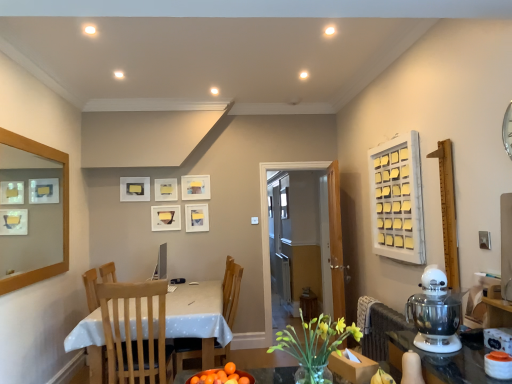
You are a GUI agent. You are given a task and a screenshot of the screen. Output one action in this format:
    pyautogui.click(x=<x>, y=<y>)
    Task: Click on the free spot above white wooden frame at upper right, placed as the second window when sorted from back to front (from a real-world perspective)
    The width and height of the screenshot is (512, 384).
    Given the screenshot: What is the action you would take?
    pyautogui.click(x=394, y=137)